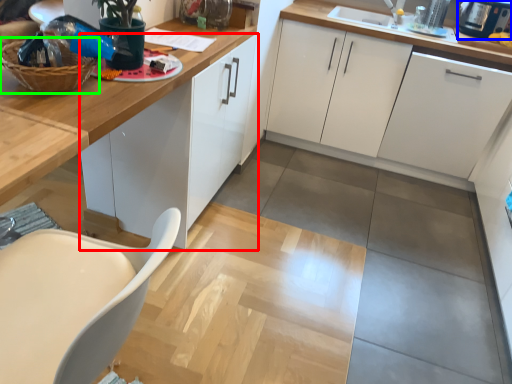
Question: Which is farther away from cabinetry (highlighted by a red box)? appliance (highlighted by a blue box) or basket (highlighted by a green box)?

Choices:
 (A) appliance
 (B) basket

Answer: (A)